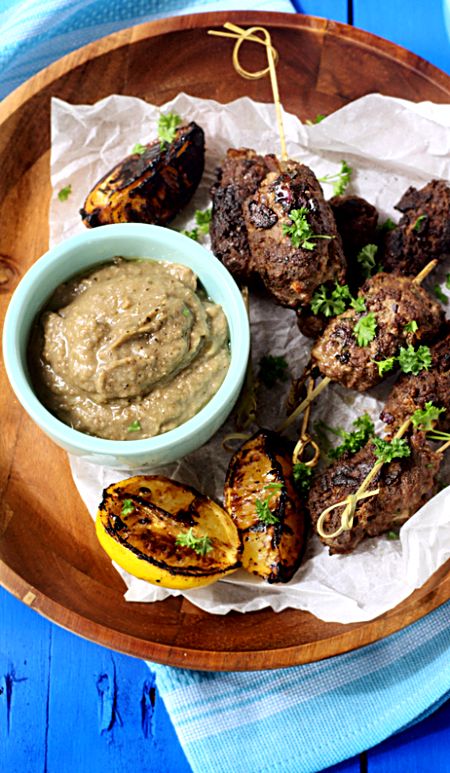
Identify the location of white pattern on napkin/towel. The width and height of the screenshot is (450, 773). (221, 723).